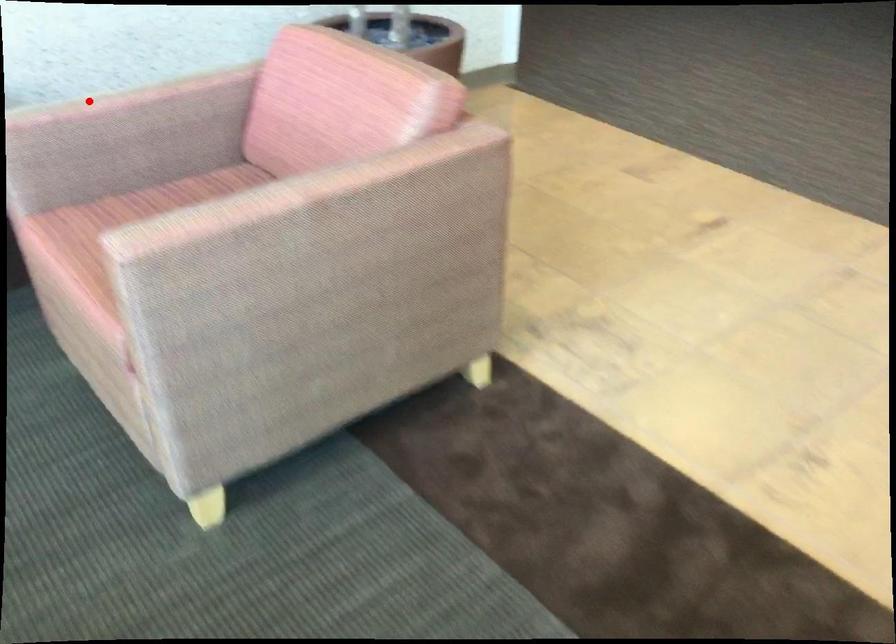
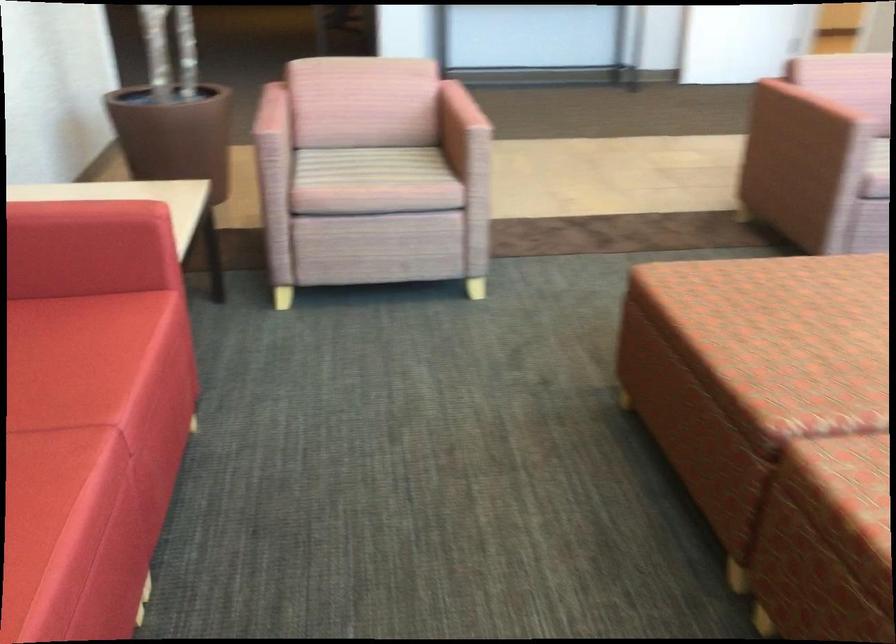
Question: I am providing you with two images of the same scene from different viewpoints. A red point is shown in image1. For the corresponding object point in image2, is it positioned nearer or farther from the camera?

Choices:
 (A) Nearer
 (B) Farther

Answer: (B)